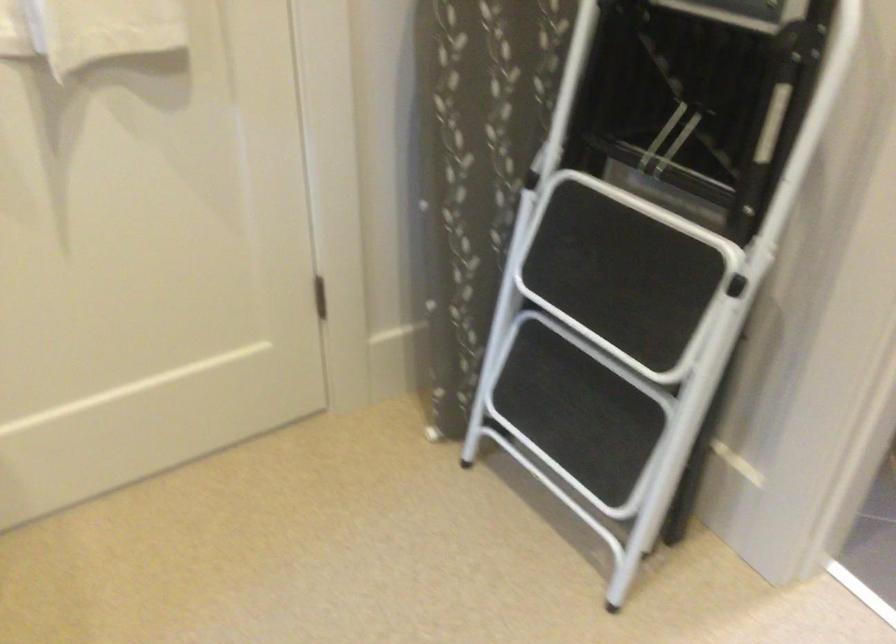
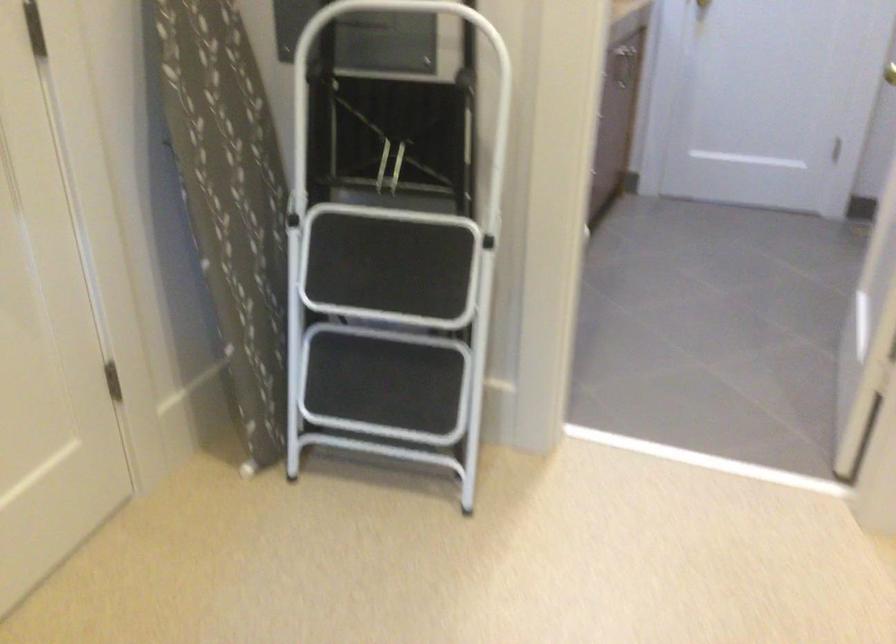
Question: I am providing you with two images of the same scene from different viewpoints. After the viewpoint changes to image2, which objects are now occluded?

Choices:
 (A) white stool handle
 (B) folding step ladder
 (C) patterned ironing board
 (D) orca whale toy

Answer: (B)